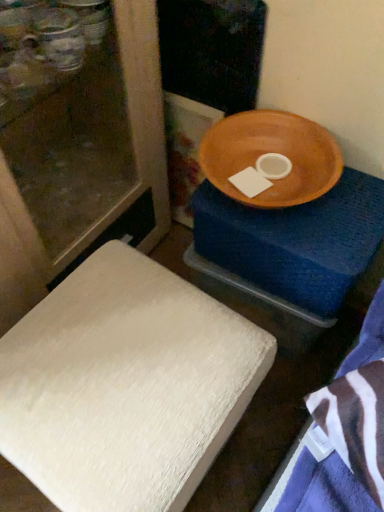
Question: Can you confirm if white textured cushion at lower left is taller than wooden bowl at upper right?

Choices:
 (A) no
 (B) yes

Answer: (A)

Question: Could you tell me if white textured cushion at lower left is turned towards wooden bowl at upper right?

Choices:
 (A) yes
 (B) no

Answer: (B)

Question: Does white textured cushion at lower left come behind wooden bowl at upper right?

Choices:
 (A) yes
 (B) no

Answer: (B)

Question: Does white textured cushion at lower left come in front of wooden bowl at upper right?

Choices:
 (A) yes
 (B) no

Answer: (A)

Question: Is white textured cushion at lower left shorter than wooden bowl at upper right?

Choices:
 (A) yes
 (B) no

Answer: (A)

Question: Is wooden bowl at upper right located within white textured cushion at lower left?

Choices:
 (A) no
 (B) yes

Answer: (A)

Question: Considering the relative sizes of wooden bowl at upper right and white textured cushion at lower left in the image provided, is wooden bowl at upper right taller than white textured cushion at lower left?

Choices:
 (A) no
 (B) yes

Answer: (B)

Question: Is wooden bowl at upper right bigger than white textured cushion at lower left?

Choices:
 (A) yes
 (B) no

Answer: (B)

Question: From the image's perspective, would you say wooden bowl at upper right is shown under white textured cushion at lower left?

Choices:
 (A) yes
 (B) no

Answer: (B)

Question: Is wooden bowl at upper right surrounding white textured cushion at lower left?

Choices:
 (A) no
 (B) yes

Answer: (A)

Question: Considering the relative sizes of wooden bowl at upper right and white textured cushion at lower left in the image provided, is wooden bowl at upper right thinner than white textured cushion at lower left?

Choices:
 (A) yes
 (B) no

Answer: (A)

Question: Is wooden bowl at upper right oriented towards white textured cushion at lower left?

Choices:
 (A) yes
 (B) no

Answer: (A)

Question: In terms of height, does white textured cushion at lower left look taller or shorter compared to wooden bowl at upper right?

Choices:
 (A) short
 (B) tall

Answer: (A)